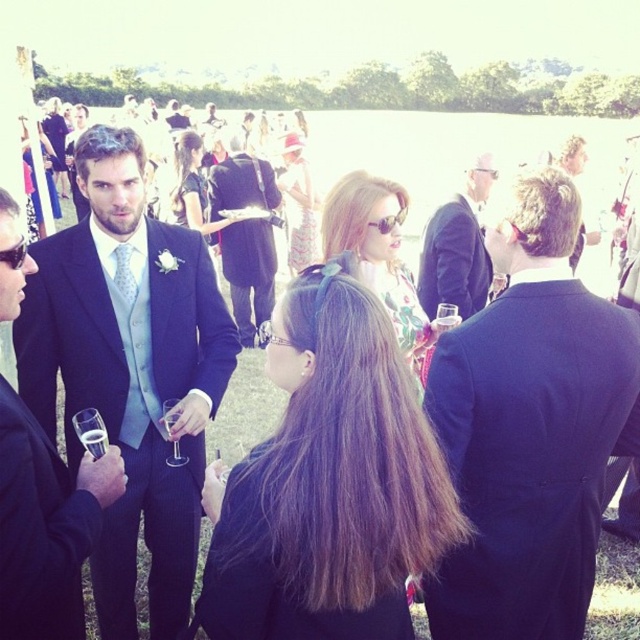
Question: Which point appears closest to the camera in this image?

Choices:
 (A) (259, 513)
 (B) (300, 257)
 (C) (484, 280)
 (D) (138, 458)

Answer: (A)

Question: Is matte blue suit at left thinner than clear glass wine at center?

Choices:
 (A) no
 (B) yes

Answer: (A)

Question: Which of the following is the closest to the observer?

Choices:
 (A) dark blue suit at center
 (B) matte blue suit at center
 (C) matte black suit at left

Answer: (C)

Question: Based on their relative distances, which object is farther from the black suit at center?

Choices:
 (A) matte blue suit at left
 (B) clear glass wine glass at center

Answer: (B)

Question: Does brown hair at center have a greater width compared to clear glass wine at center?

Choices:
 (A) no
 (B) yes

Answer: (B)

Question: Is matte blue suit at left above clear glass wine glass at center?

Choices:
 (A) yes
 (B) no

Answer: (A)